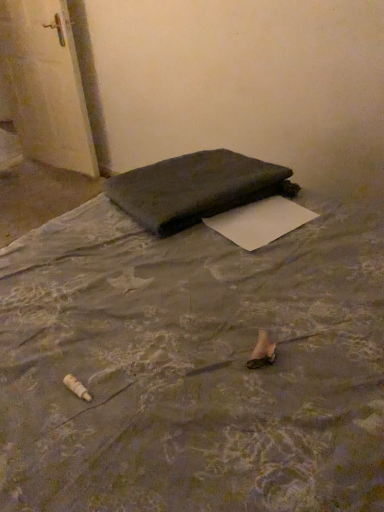
Question: Is dark fabric bag at center looking in the opposite direction of white glossy door at upper left?

Choices:
 (A) no
 (B) yes

Answer: (A)

Question: Is dark fabric bag at center thinner than white glossy door at upper left?

Choices:
 (A) yes
 (B) no

Answer: (B)

Question: Does dark fabric bag at center contain white glossy door at upper left?

Choices:
 (A) yes
 (B) no

Answer: (B)

Question: Considering the relative positions of dark fabric bag at center and white glossy door at upper left in the image provided, is dark fabric bag at center to the left of white glossy door at upper left from the viewer's perspective?

Choices:
 (A) yes
 (B) no

Answer: (B)

Question: Considering the relative positions of dark fabric bag at center and white glossy door at upper left in the image provided, is dark fabric bag at center to the right of white glossy door at upper left from the viewer's perspective?

Choices:
 (A) no
 (B) yes

Answer: (B)

Question: Is dark fabric mattress at center situated inside white glossy door at upper left or outside?

Choices:
 (A) outside
 (B) inside

Answer: (A)

Question: Considering the relative positions of dark fabric mattress at center and white glossy door at upper left in the image provided, is dark fabric mattress at center to the left or to the right of white glossy door at upper left?

Choices:
 (A) right
 (B) left

Answer: (A)

Question: Is dark fabric mattress at center taller or shorter than white glossy door at upper left?

Choices:
 (A) short
 (B) tall

Answer: (B)

Question: In the image, is dark fabric mattress at center positioned in front of or behind white glossy door at upper left?

Choices:
 (A) front
 (B) behind

Answer: (A)

Question: From the image's perspective, relative to white paper at center, is dark fabric bag at center above or below?

Choices:
 (A) below
 (B) above

Answer: (B)

Question: Considering the positions of dark fabric bag at center and white paper at center in the image, is dark fabric bag at center taller or shorter than white paper at center?

Choices:
 (A) tall
 (B) short

Answer: (A)

Question: Looking at their shapes, would you say dark fabric bag at center is wider or thinner than white paper at center?

Choices:
 (A) wide
 (B) thin

Answer: (A)

Question: Is dark fabric bag at center inside or outside of white paper at center?

Choices:
 (A) inside
 (B) outside

Answer: (B)

Question: From a real-world perspective, is white glossy door at upper left physically located above or below dark fabric bag at center?

Choices:
 (A) above
 (B) below

Answer: (B)

Question: From their relative heights in the image, would you say white glossy door at upper left is taller or shorter than dark fabric bag at center?

Choices:
 (A) short
 (B) tall

Answer: (B)